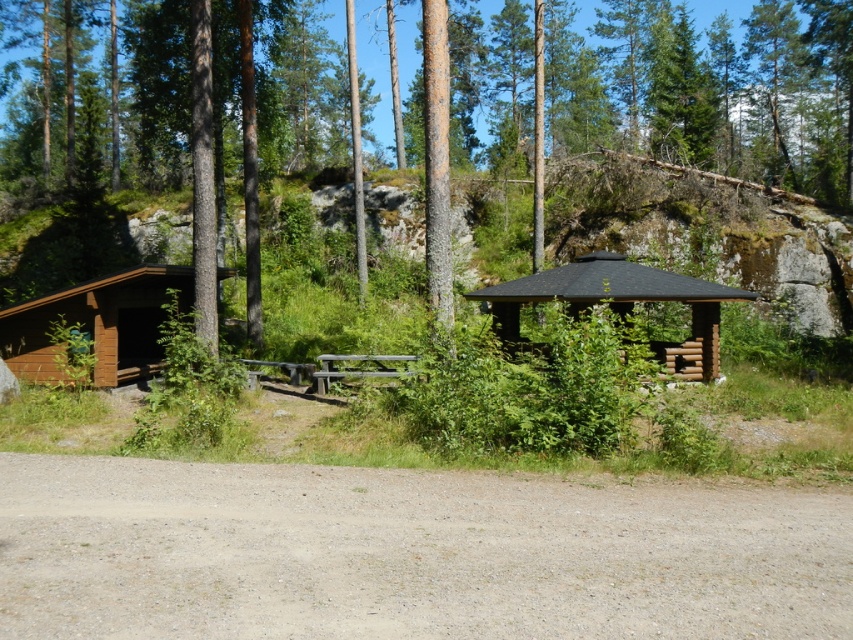
Does gray gravel dirt track at lower center come behind brown wood tree at center?

No.

Which is more to the right, gray gravel dirt track at lower center or brown wood tree at center?

brown wood tree at center is more to the right.

Does point (300, 518) come in front of point (125, 81)?

That is True.

At what (x,y) coordinates should I click in order to perform the action: click on gray gravel dirt track at lower center. Please return your answer as a coordinate pair (x, y). Looking at the image, I should click on (408, 554).

Does gray gravel dirt track at lower center appear over brown wooden hut at center?

No, gray gravel dirt track at lower center is not above brown wooden hut at center.

Can you confirm if gray gravel dirt track at lower center is taller than brown wooden hut at center?

Incorrect, gray gravel dirt track at lower center's height is not larger of brown wooden hut at center's.

Measure the distance between gray gravel dirt track at lower center and camera.

The distance of gray gravel dirt track at lower center from camera is 21.00 feet.

At what (x,y) coordinates should I click in order to perform the action: click on gray gravel dirt track at lower center. Please return your answer as a coordinate pair (x, y). Image resolution: width=853 pixels, height=640 pixels. Looking at the image, I should click on (408, 554).

Is brown wood tree at center wider than brown wooden hut at center?

Indeed, brown wood tree at center has a greater width compared to brown wooden hut at center.

Can you confirm if brown wood tree at center is positioned above brown wooden hut at center?

Correct, brown wood tree at center is located above brown wooden hut at center.

Does point (717, 134) come farther from viewer compared to point (582, 266)?

Yes, it is behind point (582, 266).

The height and width of the screenshot is (640, 853). Find the location of `brown wood tree at center`. brown wood tree at center is located at coordinates (709, 92).